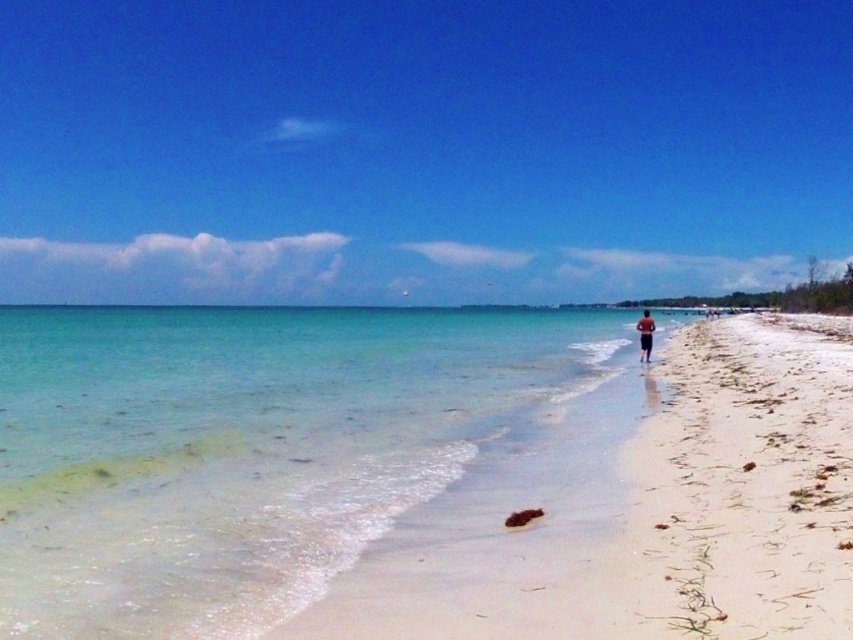
Question: Which of the following is the farthest from the observer?

Choices:
 (A) (816, 416)
 (B) (706, 532)
 (C) (636, 328)

Answer: (C)

Question: Which object is positioned farthest from the white sandy beach at right?

Choices:
 (A) white sandy beach at center
 (B) brown textured shorts at center-right

Answer: (B)

Question: Is white sandy beach at right below brown textured shorts at center-right?

Choices:
 (A) yes
 (B) no

Answer: (A)

Question: Can you confirm if white sandy beach at center is positioned above white sandy beach at right?

Choices:
 (A) yes
 (B) no

Answer: (A)

Question: Can you confirm if white sandy beach at center is thinner than white sandy beach at right?

Choices:
 (A) no
 (B) yes

Answer: (A)

Question: Which object appears farthest from the camera in this image?

Choices:
 (A) white sandy beach at right
 (B) white sandy beach at center

Answer: (B)